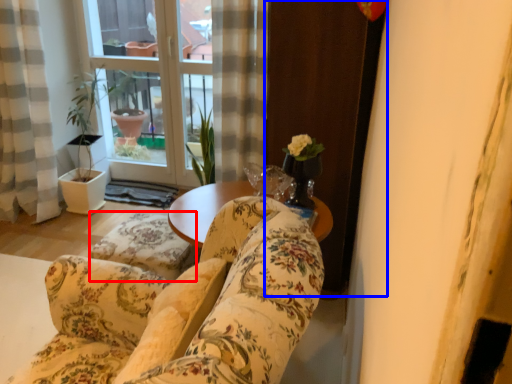
Question: Which point is further to the camera, flat (highlighted by a red box) or screen door (highlighted by a blue box)?

Choices:
 (A) flat
 (B) screen door

Answer: (A)